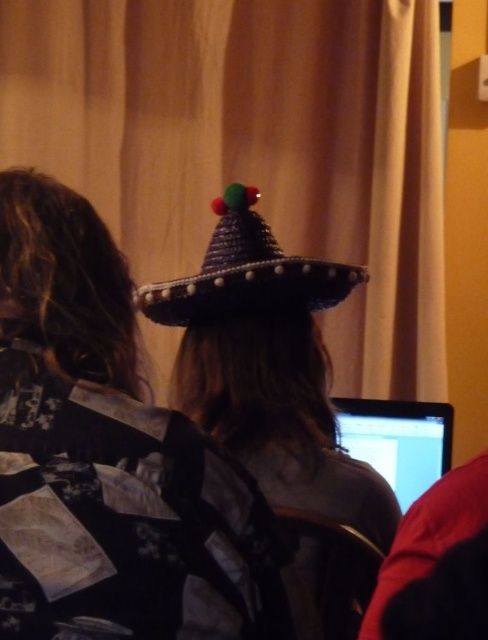
You are a delivery person who needs to place a package on the table between the woven straw hat at center and the woven straw sombrero at upper center. Where should you place the package so it is closer to the sombrero?

Place the package closer to the woven straw sombrero at upper center since it is above the woven straw hat at center.

Consider the image. You are standing in front of the scene and want to locate the woven straw sombrero at upper center. What are its coordinates?

The woven straw sombrero at upper center is located at coordinates point (246, 273).

You are a tailor measuring hats for two customers. The customers want to know which hat is taller between the woven straw hat at center and the woven straw sombrero at upper center. Which one should you recommend?

The woven straw hat at center is much taller than the woven straw sombrero at upper center, so you should recommend the woven straw hat at center if the customer prefers a taller hat.